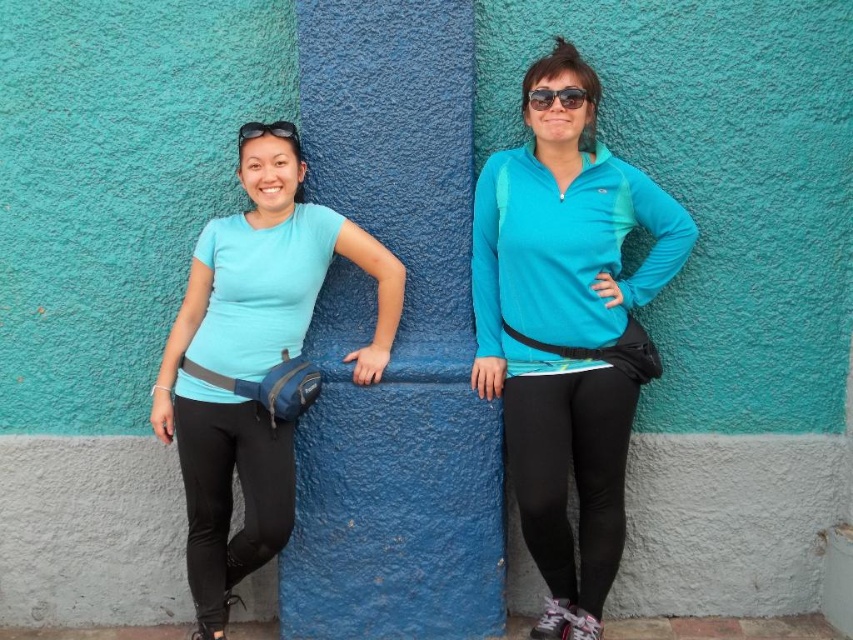
Question: Can you confirm if matte blue shirt at left is smaller than black rubber goggles at upper left?

Choices:
 (A) no
 (B) yes

Answer: (A)

Question: Which of the following is the closest to the observer?

Choices:
 (A) black rubber goggles at upper left
 (B) matte blue shirt at left

Answer: (B)

Question: Does matte blue shirt at left have a lesser width compared to matte black sunglasses at center?

Choices:
 (A) yes
 (B) no

Answer: (B)

Question: Which is farther from the matte blue shirt at left?

Choices:
 (A) matte black sunglasses at center
 (B) black rubber goggles at upper left
 (C) matte blue zip-up jacket at center

Answer: (A)

Question: Which point is closer to the camera?

Choices:
 (A) matte black sunglasses at center
 (B) black rubber goggles at upper left

Answer: (A)

Question: Does matte blue zip-up jacket at center come behind black rubber goggles at upper left?

Choices:
 (A) no
 (B) yes

Answer: (A)